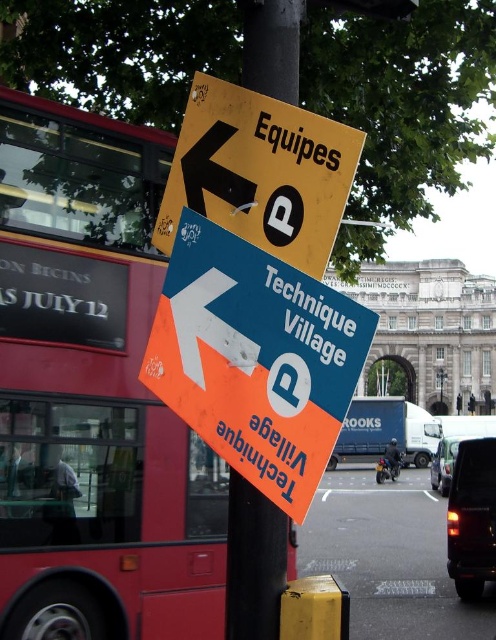
You are standing at the point with coordinates 0.561, 0.516 and want to find the blue plastic sign at center. Can you see it from your current position?

Yes, the blue plastic sign at center is exactly at the point (x=255, y=330), so you are standing right at its location and can see it clearly.

You are standing at the point of origin in the street scene. There is a blue metallic truck at center. Can you determine the truck position relative to the pole with directional signs?

The blue metallic truck at center is located at point (385, 432), which is to the right of the pole with directional signs.